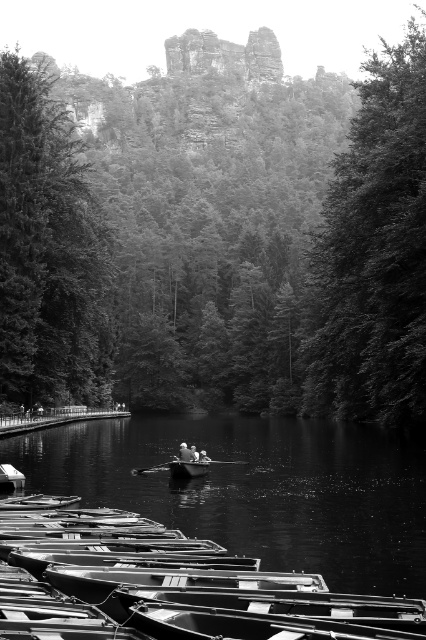
Is dark green leafy tree at right positioned at the back of dark green textured tree at left?

That is False.

Does dark green leafy tree at right have a larger size compared to dark green textured tree at left?

Yes, dark green leafy tree at right is bigger than dark green textured tree at left.

The image size is (426, 640). I want to click on dark green leafy tree at right, so click(x=374, y=253).

This screenshot has height=640, width=426. Find the location of `dark green leafy tree at right`. dark green leafy tree at right is located at coordinates (374, 253).

Is point (141, 506) positioned in front of point (186, 460)?

Yes, point (141, 506) is in front of point (186, 460).

Is smooth dark water at center to the left of wooden rowboat at center from the viewer's perspective?

In fact, smooth dark water at center is to the right of wooden rowboat at center.

This screenshot has height=640, width=426. I want to click on smooth dark water at center, so click(x=256, y=490).

Find the location of a particular element. Image resolution: width=426 pixels, height=640 pixels. smooth dark water at center is located at coordinates (256, 490).

Describe the element at coordinates (187, 468) in the screenshot. This screenshot has width=426, height=640. I see `wooden rowboat at center` at that location.

Find the location of a particular element. wooden rowboat at center is located at coordinates (187, 468).